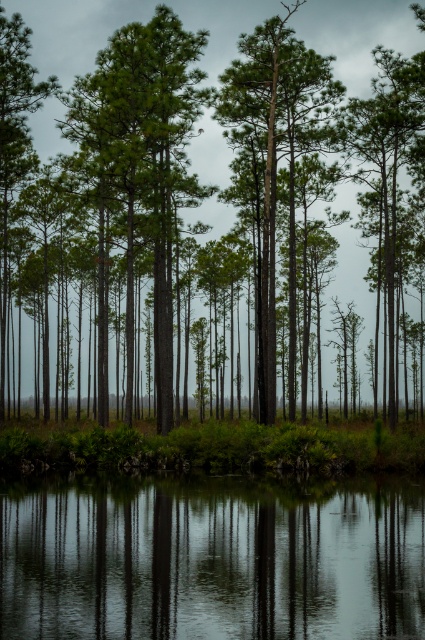
Question: Which point is farther to the camera?

Choices:
 (A) (102, 486)
 (B) (402, 48)
 (C) (277, 60)

Answer: (B)

Question: Can you confirm if green matte tree at center is positioned to the left of green rough bark tree at center?

Choices:
 (A) no
 (B) yes

Answer: (B)

Question: Which object is positioned closest to the green matte tree at center?

Choices:
 (A) green rough bark tree at center
 (B) clear water at bottom

Answer: (A)

Question: Does clear water at bottom lie in front of green rough bark tree at center?

Choices:
 (A) yes
 (B) no

Answer: (A)

Question: Is the position of clear water at bottom more distant than that of green matte tree at center?

Choices:
 (A) no
 (B) yes

Answer: (A)

Question: Among these points, which one is nearest to the camera?

Choices:
 (A) [346, 257]
 (B) [289, 12]
 (C) [42, 582]

Answer: (C)